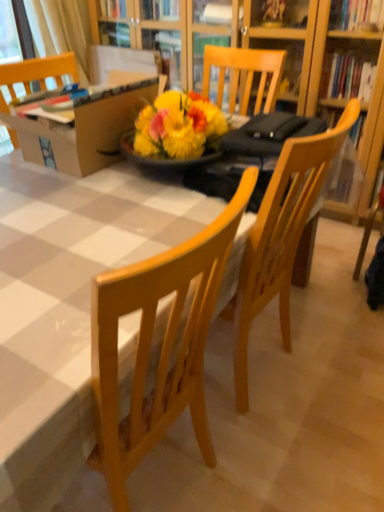
Where is `wooden table at center`? The image size is (384, 512). wooden table at center is located at coordinates (66, 305).

Measure the distance between point (66, 33) and camera.

A distance of 9.55 feet exists between point (66, 33) and camera.

This screenshot has width=384, height=512. Find the location of `wooden table at center`. wooden table at center is located at coordinates (66, 305).

Looking at this image, is white fabric curtain at upper left positioned behind cardboard box at upper left?

Yes, the depth of white fabric curtain at upper left is greater than that of cardboard box at upper left.

Is white fabric curtain at upper left turned away from cardboard box at upper left?

No, white fabric curtain at upper left is not facing away from cardboard box at upper left.

Is white fabric curtain at upper left outside of cardboard box at upper left?

Yes, white fabric curtain at upper left is located beyond the bounds of cardboard box at upper left.

Looking at this image, how many degrees apart are the facing directions of white fabric curtain at upper left and cardboard box at upper left?

There is a 85.9-degree angle between the facing directions of white fabric curtain at upper left and cardboard box at upper left.

Is white fabric curtain at upper left touching wooden table at center?

No, white fabric curtain at upper left is not in contact with wooden table at center.

Does white fabric curtain at upper left turn towards wooden table at center?

No, white fabric curtain at upper left is not turned towards wooden table at center.

Consider the image. Who is smaller, white fabric curtain at upper left or wooden table at center?

With smaller size is white fabric curtain at upper left.

Is the position of white fabric curtain at upper left less distant than that of wooden table at center?

No, white fabric curtain at upper left is further to the viewer.

Which is in front, point (56, 407) or point (139, 81)?

The point (56, 407) is in front.

Is wooden table at center oriented towards cardboard box at upper left?

No, wooden table at center does not turn towards cardboard box at upper left.

Considering the sizes of objects wooden table at center and cardboard box at upper left in the image provided, who is wider, wooden table at center or cardboard box at upper left?

wooden table at center is wider.

In the image, is wooden table at center positioned in front of or behind cardboard box at upper left?

In the image, wooden table at center appears in front of cardboard box at upper left.

Would you say cardboard box at upper left is inside or outside white fabric curtain at upper left?

cardboard box at upper left exists outside the volume of white fabric curtain at upper left.

Considering the relative positions of cardboard box at upper left and white fabric curtain at upper left in the image provided, is cardboard box at upper left to the right of white fabric curtain at upper left from the viewer's perspective?

Indeed, cardboard box at upper left is positioned on the right side of white fabric curtain at upper left.

Which of these two, cardboard box at upper left or white fabric curtain at upper left, is smaller?

With smaller size is white fabric curtain at upper left.

How much distance is there between cardboard box at upper left and white fabric curtain at upper left?

A distance of 5.60 feet exists between cardboard box at upper left and white fabric curtain at upper left.

Where is `box lying behind the wooden table at center`? This screenshot has width=384, height=512. box lying behind the wooden table at center is located at coordinates (85, 130).

Can you confirm if cardboard box at upper left is positioned to the right of wooden table at center?

No.

In the scene shown: From a real-world perspective, which is physically above, cardboard box at upper left or wooden table at center?

From a 3D spatial view, cardboard box at upper left is above.

Is cardboard box at upper left oriented away from wooden table at center?

No, cardboard box at upper left's orientation is not away from wooden table at center.

Is wooden table at center at the right side of white fabric curtain at upper left?

Yes, wooden table at center is to the right of white fabric curtain at upper left.

Can you confirm if wooden table at center is shorter than white fabric curtain at upper left?

No.

From a real-world perspective, is wooden table at center above or below white fabric curtain at upper left?

wooden table at center is below white fabric curtain at upper left.

From the picture: Is wooden table at center behind white fabric curtain at upper left?

No, the depth of wooden table at center is less than that of white fabric curtain at upper left.

At what (x,y) coordinates should I click in order to perform the action: click on curtain behind the cardboard box at upper left. Please return your answer as a coordinate pair (x, y). Looking at the image, I should click on (61, 30).

Where is `curtain that appears above the wooden table at center (from the image's perspective)`? Image resolution: width=384 pixels, height=512 pixels. curtain that appears above the wooden table at center (from the image's perspective) is located at coordinates (61, 30).

From the image, which object appears to be farther from wooden table at center, white fabric curtain at upper left or cardboard box at upper left?

Based on the image, white fabric curtain at upper left appears to be further to wooden table at center.

Which object lies further to the anchor point white fabric curtain at upper left, cardboard box at upper left or wooden table at center?

wooden table at center lies further to white fabric curtain at upper left than the other object.

Which object lies further to the anchor point cardboard box at upper left, wooden table at center or white fabric curtain at upper left?

The object further to cardboard box at upper left is white fabric curtain at upper left.

Based on the photo, estimate the real-world distances between objects in this image. Which object is further from cardboard box at upper left, white fabric curtain at upper left or wooden table at center?

Among the two, white fabric curtain at upper left is located further to cardboard box at upper left.

From the picture: When comparing their distances from white fabric curtain at upper left, does wooden table at center or cardboard box at upper left seem further?

Among the two, wooden table at center is located further to white fabric curtain at upper left.

When comparing their distances from wooden table at center, does cardboard box at upper left or white fabric curtain at upper left seem further?

white fabric curtain at upper left is further to wooden table at center.

Find the location of `box located between wooden table at center and white fabric curtain at upper left in the depth direction`. box located between wooden table at center and white fabric curtain at upper left in the depth direction is located at coordinates (85, 130).